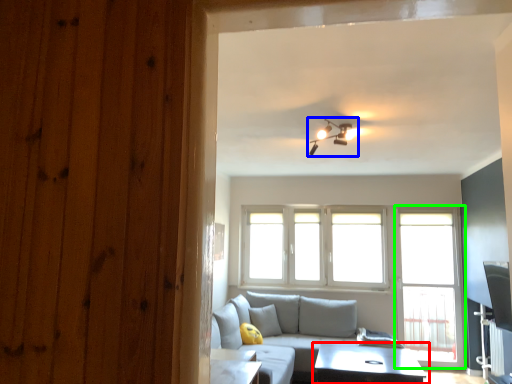
Question: Estimate the real-world distances between objects in this image. Which object is closer to table (highlighted by a red box), light fixture (highlighted by a blue box) or screen door (highlighted by a green box)?

Choices:
 (A) light fixture
 (B) screen door

Answer: (B)